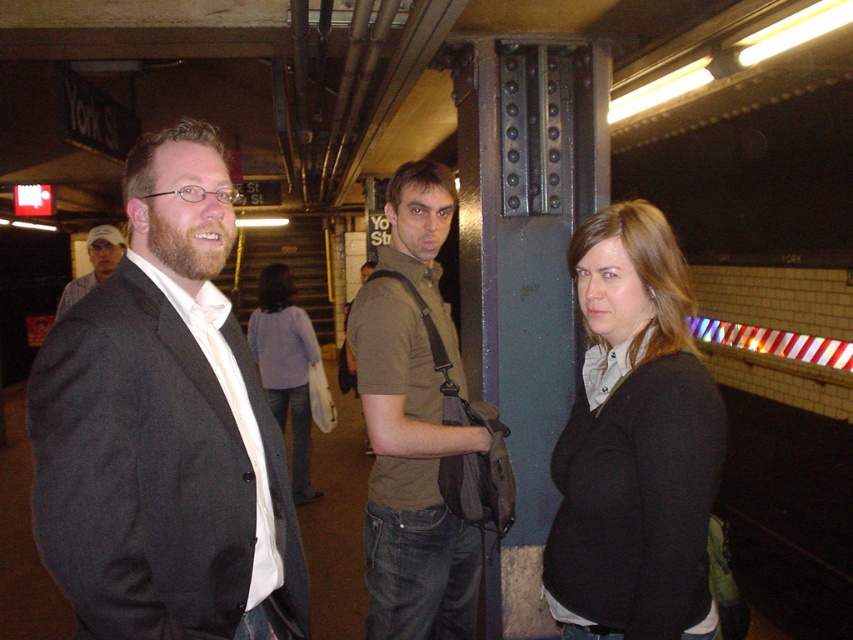
You are a photographer standing in the subway station and want to take a photo of the matte black suit at left and the matte brown shirt at center. To ensure both are in frame, should you adjust your camera to focus more to the left or the right side of your current view?

You should focus more to the left side of your current view because the matte black suit at left is positioned to the left of the matte brown shirt at center.

You are a photographer trying to capture a detailed shot of both the black matte sweater at center and the bearded man at left. Since you want to ensure both are in focus, which object should you prioritize focusing on first to maximize the chances of both being sharp?

The black matte sweater at center is closer to the viewer than the bearded man at left. To ensure both are in focus, you should focus on the farther object, which is the bearded man at left, as focusing on the farther subject will naturally include the closer one within the depth of field.

You are a photographer trying to capture a group photo of the black matte sweater at center and the bearded man at left. Since you want to ensure both subjects are in the frame, can you confirm if they are positioned side by side horizontally?

The black matte sweater at center is to the right of bearded man at left, so they are positioned side by side horizontally.